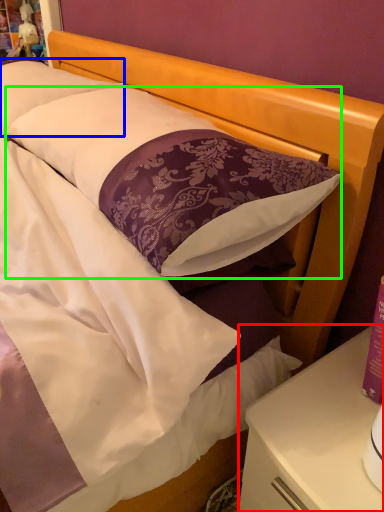
Question: Based on their relative distances, which object is farther from nightstand (highlighted by a red box)? Choose from pillow (highlighted by a blue box) and pillow (highlighted by a green box).

Choices:
 (A) pillow
 (B) pillow

Answer: (A)